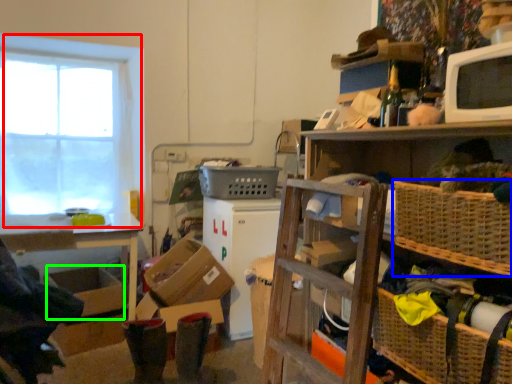
Question: Estimate the real-world distances between objects in this image. Which object is farther from window (highlighted by a red box), basket (highlighted by a blue box) or storage box (highlighted by a green box)?

Choices:
 (A) basket
 (B) storage box

Answer: (A)